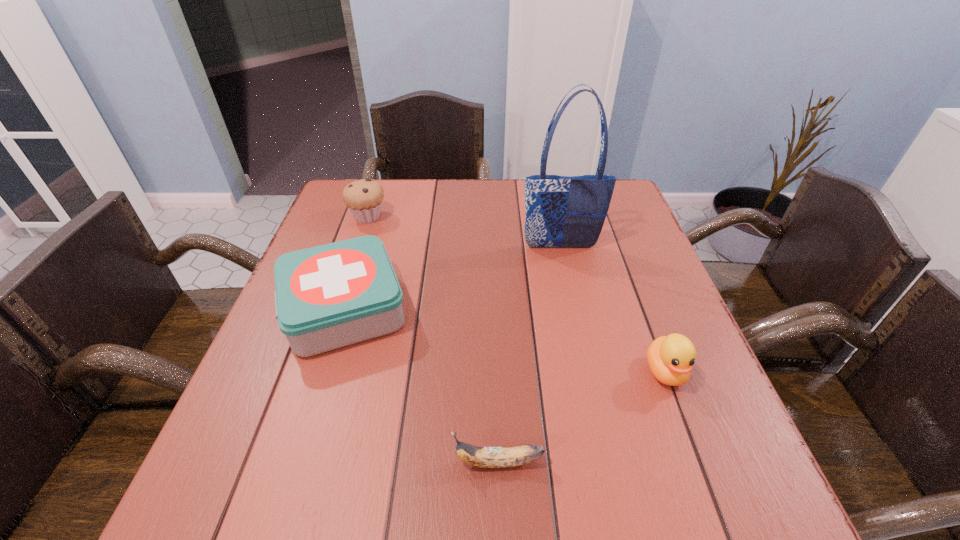
Identify the location of the tallest object. This screenshot has width=960, height=540. (561, 211).

Where is `shopping bag`? shopping bag is located at coordinates (561, 211).

You are a GUI agent. You are given a task and a screenshot of the screen. Output one action in this format:
    pyautogui.click(x=<x>, y=<y>)
    Task: Click on the farthest object
    This screenshot has width=960, height=540.
    Given the screenshot: What is the action you would take?
    pyautogui.click(x=364, y=198)

Find the location of a particular element. This screenshot has height=540, width=960. the first-aid kit is located at coordinates (326, 297).

Locate an element on the screen. This screenshot has width=960, height=540. the rightmost object is located at coordinates (671, 358).

At what (x,y) coordinates should I click in order to perform the action: click on the nearest object. Please return your answer as a coordinate pair (x, y). Looking at the image, I should click on (485, 457).

Locate an element on the screen. The image size is (960, 540). the shortest object is located at coordinates (485, 457).

Locate an element on the screen. The image size is (960, 540). free space located on the front-facing side of the fourth nearest object is located at coordinates (584, 354).

The width and height of the screenshot is (960, 540). What are the coordinates of `free spot located 0.150m on the back of the muffin` in the screenshot? It's located at (380, 180).

At what (x,y) coordinates should I click in order to perform the action: click on vacant point located 0.350m on the back of the first-aid kit. Please return your answer as a coordinate pair (x, y). Looking at the image, I should click on (381, 193).